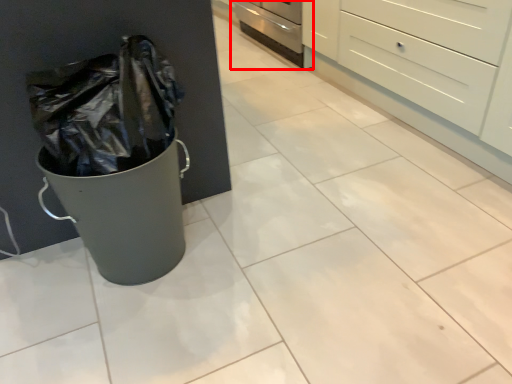
Question: Observing the image, what is the correct spatial positioning of oven (annotated by the red box) in reference to chest of drawers?

Choices:
 (A) right
 (B) left

Answer: (B)